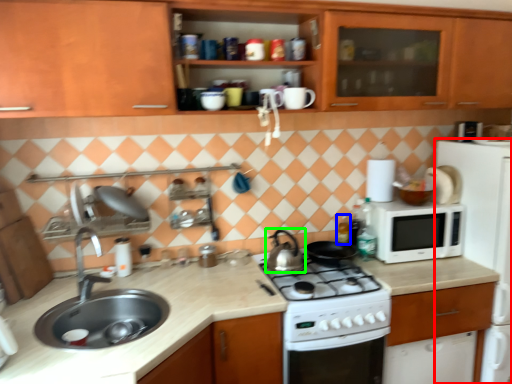
Question: Which object is positioned closest to home appliance (highlighted by a red box)? Select from bottle (highlighted by a blue box) and kitchen appliance (highlighted by a green box).

Choices:
 (A) bottle
 (B) kitchen appliance

Answer: (A)